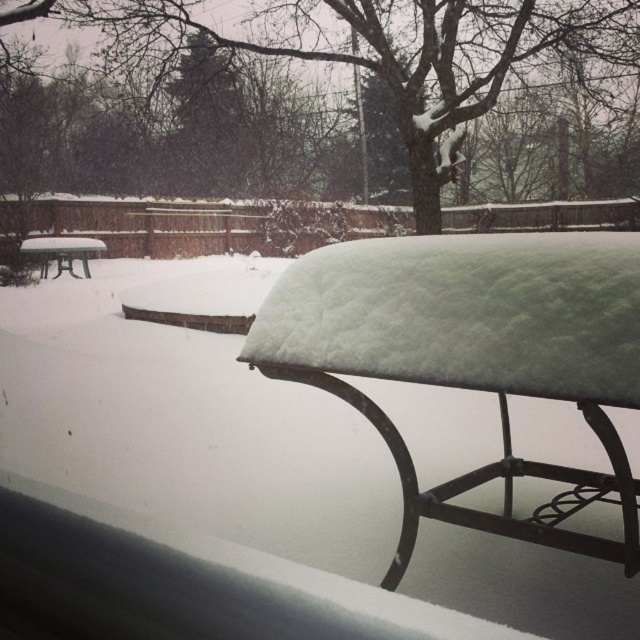
Question: Can you confirm if white snow-covered bench at center is positioned below green plastic picnic table at left?

Choices:
 (A) no
 (B) yes

Answer: (B)

Question: Where is white snow-covered bench at center located in relation to green plastic picnic table at left in the image?

Choices:
 (A) left
 (B) right

Answer: (B)

Question: Which point appears closest to the camera in this image?

Choices:
 (A) (572, 369)
 (B) (65, 243)

Answer: (A)

Question: Is white snow-covered bench at center above green plastic picnic table at left?

Choices:
 (A) yes
 (B) no

Answer: (B)